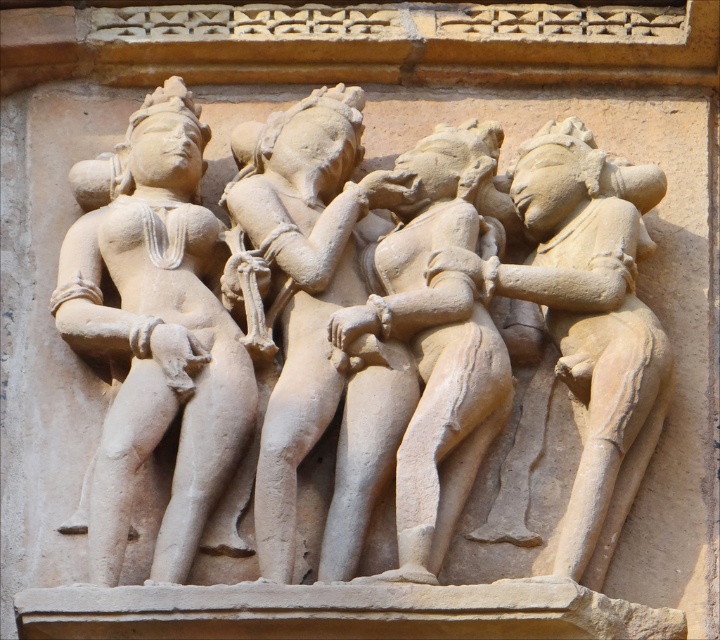
Question: Is beige stone sculpture at center to the right of matte stone statue at center from the viewer's perspective?

Choices:
 (A) no
 (B) yes

Answer: (B)

Question: Which point appears farthest from the camera in this image?

Choices:
 (A) (258, 461)
 (B) (181, 417)
 (C) (600, 152)

Answer: (C)

Question: Which object is farther from the camera taking this photo?

Choices:
 (A) smooth beige statue at center
 (B) smooth beige statue at left
 (C) beige stone sculpture at center
 (D) matte stone statue at center

Answer: (D)

Question: In this image, where is beige stone sculpture at center located relative to smooth beige statue at left?

Choices:
 (A) right
 (B) left

Answer: (A)

Question: Among these objects, which one is nearest to the camera?

Choices:
 (A) smooth beige statue at center
 (B) smooth beige statue at left

Answer: (A)

Question: Can you confirm if beige stone sculpture at center is smaller than smooth beige statue at center?

Choices:
 (A) no
 (B) yes

Answer: (A)